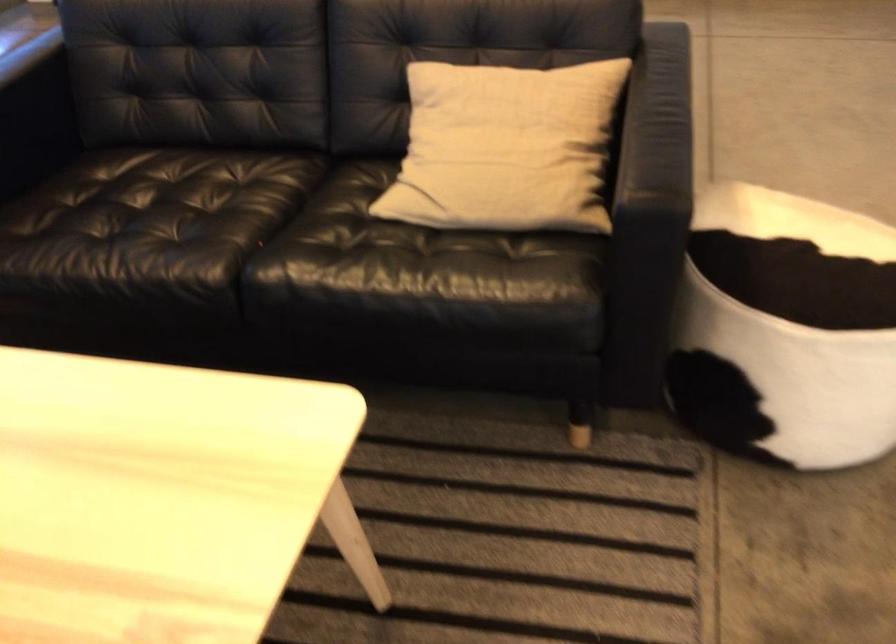
What do you see at coordinates (174, 211) in the screenshot?
I see `a sofa sitting surface` at bounding box center [174, 211].